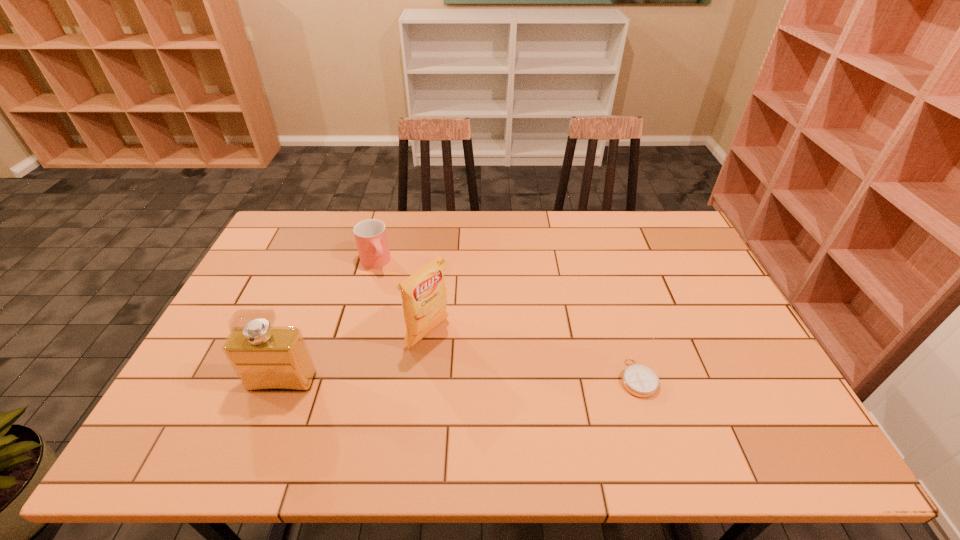
Locate an element on the screen. free space located 0.200m on the side of the farthest object with the handle is located at coordinates (403, 314).

Identify the location of vacant space located on the front of the second farthest object with the logo. (509, 390).

This screenshot has height=540, width=960. I want to click on free location located on the front of the second farthest object with the logo, so click(502, 386).

You are a GUI agent. You are given a task and a screenshot of the screen. Output one action in this format:
    pyautogui.click(x=<x>, y=<y>)
    Task: Click on the vacant point located 0.130m on the front of the second farthest object with the logo
    
    Given the screenshot: What is the action you would take?
    pyautogui.click(x=480, y=371)

Identify the location of object present at the far edge. (370, 235).

This screenshot has width=960, height=540. I want to click on perfume located at the near edge, so click(x=266, y=359).

This screenshot has width=960, height=540. In order to click on compass at the near edge in this screenshot , I will do `click(639, 380)`.

Where is `object present at the left edge`? This screenshot has width=960, height=540. object present at the left edge is located at coordinates click(266, 359).

The width and height of the screenshot is (960, 540). In order to click on object that is positioned at the near left corner in this screenshot , I will do `click(266, 359)`.

In the image, there is a desktop. Where is `vacant space at the far edge`? vacant space at the far edge is located at coordinates (567, 227).